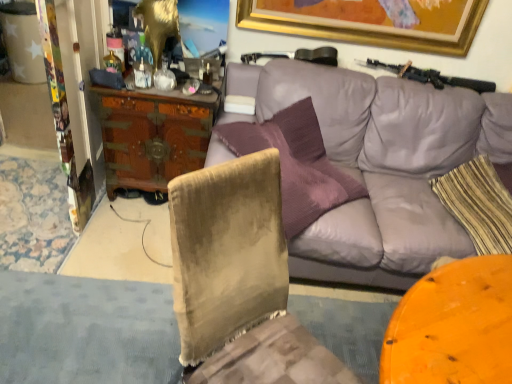
In order to face wooden carved desk at center left, should I rotate leftwards or rightwards?

You should rotate left by 12.154 degrees.

What do you see at coordinates (153, 135) in the screenshot? The width and height of the screenshot is (512, 384). I see `wooden carved desk at center left` at bounding box center [153, 135].

In order to face black matte shotgun at upper right, should I rotate leftwards or rightwards?

A 23.224 degree turn to the right will do.

What do you see at coordinates (380, 165) in the screenshot? I see `purple leather couch at upper center` at bounding box center [380, 165].

I want to click on striped fabric pillow at right, so click(480, 202).

Considering the sizes of wooden carved desk at center left and striped fabric pillow at right in the image, is wooden carved desk at center left bigger or smaller than striped fabric pillow at right?

In the image, wooden carved desk at center left appears to be larger than striped fabric pillow at right.

Can you confirm if wooden carved desk at center left is shorter than striped fabric pillow at right?

No, wooden carved desk at center left is not shorter than striped fabric pillow at right.

From a real-world perspective, who is located higher, wooden carved desk at center left or striped fabric pillow at right?

striped fabric pillow at right is physically above.

Is purple leather couch at upper center to the right of velvet chair at lower left from the viewer's perspective?

Yes.

Does purple leather couch at upper center have a lesser width compared to velvet chair at lower left?

In fact, purple leather couch at upper center might be wider than velvet chair at lower left.

Is purple leather couch at upper center surrounding velvet chair at lower left?

No, velvet chair at lower left is not a part of purple leather couch at upper center.

Is point (331, 140) positioned behind point (167, 322)?

Yes, it is.

From the image's perspective, is wooden carved desk at center left above or below black matte shotgun at upper right?

From the image's perspective, wooden carved desk at center left appears below black matte shotgun at upper right.

In the scene shown: Is wooden carved desk at center left located outside black matte shotgun at upper right?

Yes, wooden carved desk at center left is outside of black matte shotgun at upper right.

Is wooden carved desk at center left turned away from black matte shotgun at upper right?

wooden carved desk at center left does not have its back to black matte shotgun at upper right.

Considering the sizes of objects wooden carved desk at center left and black matte shotgun at upper right in the image provided, who is shorter, wooden carved desk at center left or black matte shotgun at upper right?

With less height is black matte shotgun at upper right.

How many degrees apart are the facing directions of black matte shotgun at upper right and velvet chair at lower left?

There is a 179-degree angle between the facing directions of black matte shotgun at upper right and velvet chair at lower left.

Considering the positions of point (456, 79) and point (100, 335), is point (456, 79) closer or farther from the camera than point (100, 335)?

Clearly, point (456, 79) is more distant from the camera than point (100, 335).

Can you confirm if black matte shotgun at upper right is shorter than velvet chair at lower left?

Incorrect, the height of black matte shotgun at upper right does not fall short of that of velvet chair at lower left.

From a real-world perspective, which is physically above, black matte shotgun at upper right or velvet chair at lower left?

In real-world perspective, black matte shotgun at upper right is above.

Do you think black matte shotgun at upper right is within wooden carved desk at center left, or outside of it?

black matte shotgun at upper right is not enclosed by wooden carved desk at center left.

Is black matte shotgun at upper right positioned with its back to wooden carved desk at center left?

No, black matte shotgun at upper right is not facing the opposite direction of wooden carved desk at center left.

At what (x,y) coordinates should I click in order to perform the action: click on shotgun above the wooden carved desk at center left (from a real-world perspective). Please return your answer as a coordinate pair (x, y). The width and height of the screenshot is (512, 384). Looking at the image, I should click on (430, 76).

Considering the positions of objects striped fabric pillow at right and velvet chair at lower left in the image provided, who is more to the left, striped fabric pillow at right or velvet chair at lower left?

Positioned to the left is velvet chair at lower left.

Can you confirm if striped fabric pillow at right is shorter than velvet chair at lower left?

Incorrect, the height of striped fabric pillow at right does not fall short of that of velvet chair at lower left.

Considering the relative sizes of striped fabric pillow at right and velvet chair at lower left in the image provided, is striped fabric pillow at right wider than velvet chair at lower left?

No, striped fabric pillow at right is not wider than velvet chair at lower left.

Can you tell me how much striped fabric pillow at right and velvet chair at lower left differ in facing direction?

96 degrees separate the facing orientations of striped fabric pillow at right and velvet chair at lower left.

Is point (492, 128) more distant than point (499, 200)?

Yes.

From a real-world perspective, between purple leather couch at upper center and striped fabric pillow at right, who is vertically higher?

striped fabric pillow at right.

Is purple leather couch at upper center aimed at striped fabric pillow at right?

Yes, purple leather couch at upper center is turned towards striped fabric pillow at right.

Considering the sizes of objects purple leather couch at upper center and striped fabric pillow at right in the image provided, who is thinner, purple leather couch at upper center or striped fabric pillow at right?

striped fabric pillow at right.

I want to click on desk lying behind the striped fabric pillow at right, so click(x=153, y=135).

Image resolution: width=512 pixels, height=384 pixels. Identify the location of gray lying below the purple leather couch at upper center (from the image's perspective). (86, 330).

Looking at the image, which one is located further to velvet chair at lower left, black matte shotgun at upper right or striped fabric pillow at right?

black matte shotgun at upper right.

Looking at this image, from the image, which object appears to be nearer to striped fabric pillow at right, wooden carved desk at center left or velvet chair at lower left?

wooden carved desk at center left lies closer to striped fabric pillow at right than the other object.

From the image, which object appears to be nearer to velvet chair at lower left, striped fabric pillow at right or purple leather couch at upper center?

Among the two, purple leather couch at upper center is located nearer to velvet chair at lower left.

Looking at the image, which one is located closer to purple leather couch at upper center, black matte shotgun at upper right or striped fabric pillow at right?

Among the two, striped fabric pillow at right is located nearer to purple leather couch at upper center.

From the image, which object appears to be farther from black matte shotgun at upper right, purple leather couch at upper center or velvet chair at lower left?

velvet chair at lower left.

Estimate the real-world distances between objects in this image. Which object is closer to wooden carved desk at center left, striped fabric pillow at right or purple leather couch at upper center?

The object closer to wooden carved desk at center left is purple leather couch at upper center.

Estimate the real-world distances between objects in this image. Which object is closer to velvet chair at lower left, striped fabric pillow at right or black matte shotgun at upper right?

striped fabric pillow at right is positioned closer to the anchor velvet chair at lower left.

Consider the image. Considering their positions, is striped fabric pillow at right positioned further to black matte shotgun at upper right than purple leather couch at upper center?

striped fabric pillow at right is further to black matte shotgun at upper right.

In order to click on pillow between purple leather couch at upper center and black matte shotgun at upper right along the z-axis in this screenshot , I will do `click(480, 202)`.

Where is `shotgun located between velvet chair at lower left and striped fabric pillow at right in the left-right direction`? shotgun located between velvet chair at lower left and striped fabric pillow at right in the left-right direction is located at coordinates (430, 76).

The width and height of the screenshot is (512, 384). I want to click on studio couch between wooden carved desk at center left and black matte shotgun at upper right from left to right, so [380, 165].

The image size is (512, 384). I want to click on studio couch between wooden carved desk at center left and striped fabric pillow at right from left to right, so click(380, 165).